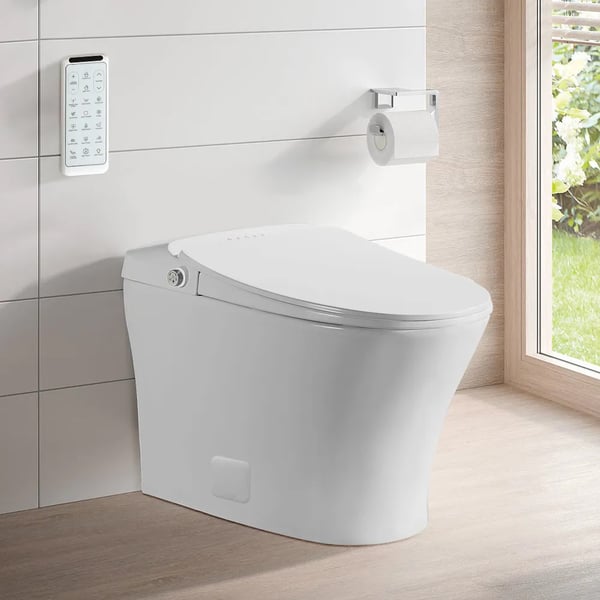
In order to click on toilet roll in this screenshot , I will do `click(409, 132)`.